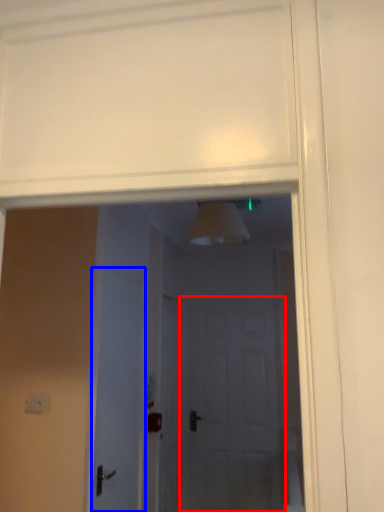
Question: Which object appears closest to the camera in this image, screen door (highlighted by a red box) or door (highlighted by a blue box)?

Choices:
 (A) screen door
 (B) door

Answer: (B)